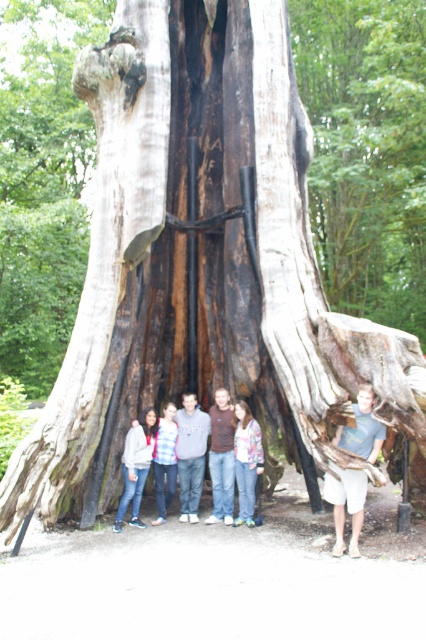
Question: Which point is closer to the camera taking this photo?

Choices:
 (A) (359, 492)
 (B) (121, 460)

Answer: (A)

Question: Which point is farther to the camera?

Choices:
 (A) (379, 422)
 (B) (146, 433)
 (C) (170, 477)
 (D) (189, 426)

Answer: (D)

Question: Is light brown wood at right above blue denim jeans at center?

Choices:
 (A) no
 (B) yes

Answer: (B)

Question: Considering the relative positions of gray sweater at center and blue denim jeans at center in the image provided, where is gray sweater at center located with respect to blue denim jeans at center?

Choices:
 (A) above
 (B) below

Answer: (A)

Question: Which of the following is the closest to the observer?

Choices:
 (A) (235, 435)
 (B) (173, 461)
 (C) (129, 483)
 (D) (178, 442)

Answer: (C)

Question: Is light brown wood at right further to the viewer compared to brown matte shirt at center?

Choices:
 (A) yes
 (B) no

Answer: (B)